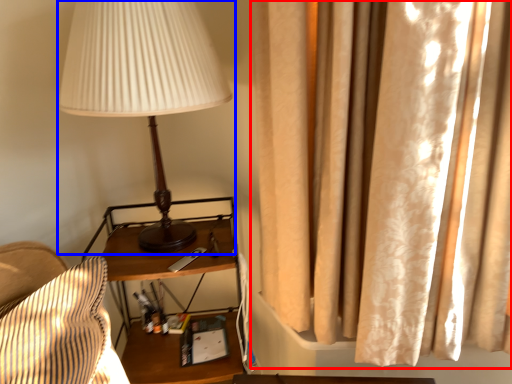
Question: Among these objects, which one is nearest to the camera, curtain (highlighted by a red box) or lamp (highlighted by a blue box)?

Choices:
 (A) curtain
 (B) lamp

Answer: (A)